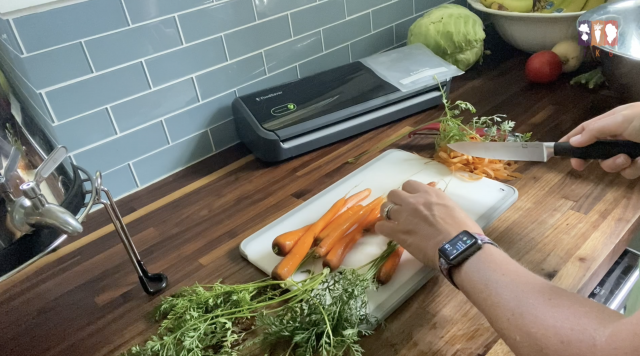
I want to click on black handle, so click(600, 147).